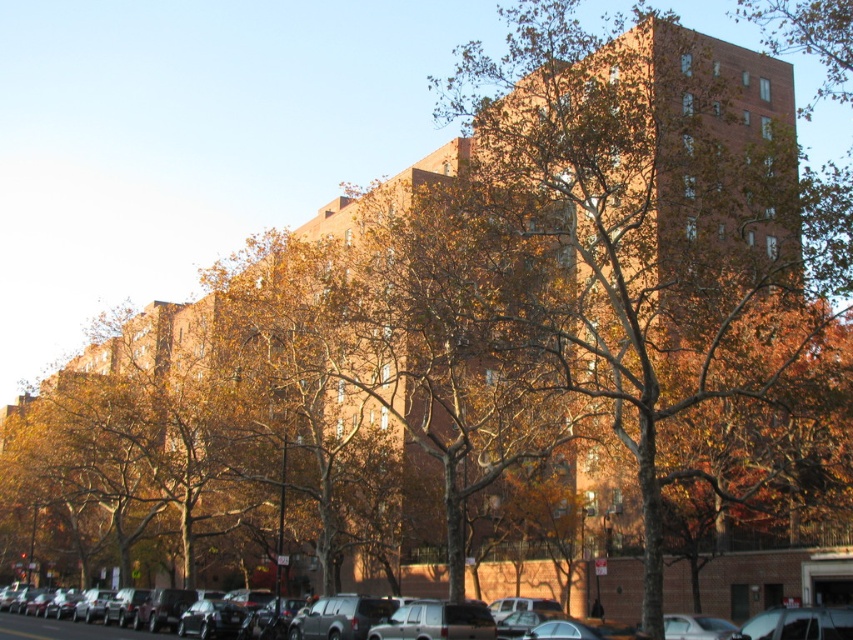
Does point (474, 61) lie in front of point (4, 637)?

No.

Can you confirm if brown textured tree at center is positioned above matte black suv at center?

Indeed, brown textured tree at center is positioned over matte black suv at center.

Who is more distant from viewer, (645, 243) or (109, 636)?

The point (109, 636) is more distant.

Find the location of a particular element. brown textured tree at center is located at coordinates (653, 225).